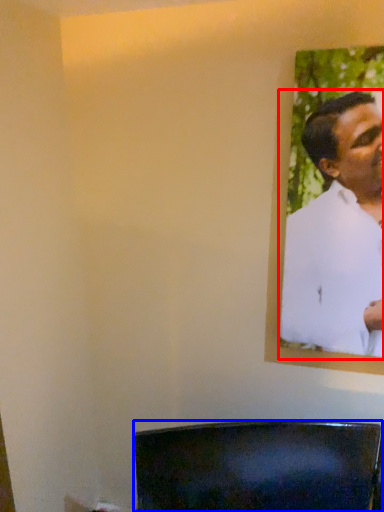
Question: Which object is closer to the camera taking this photo, man (highlighted by a red box) or furniture (highlighted by a blue box)?

Choices:
 (A) man
 (B) furniture

Answer: (A)